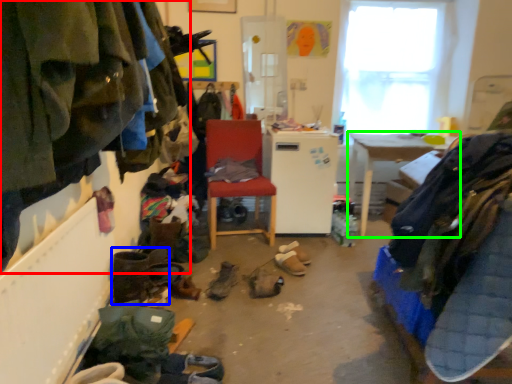
Question: Considering the real-world distances, which object is closest to clothing (highlighted by a red box)? footwear (highlighted by a blue box) or table (highlighted by a green box).

Choices:
 (A) footwear
 (B) table

Answer: (A)